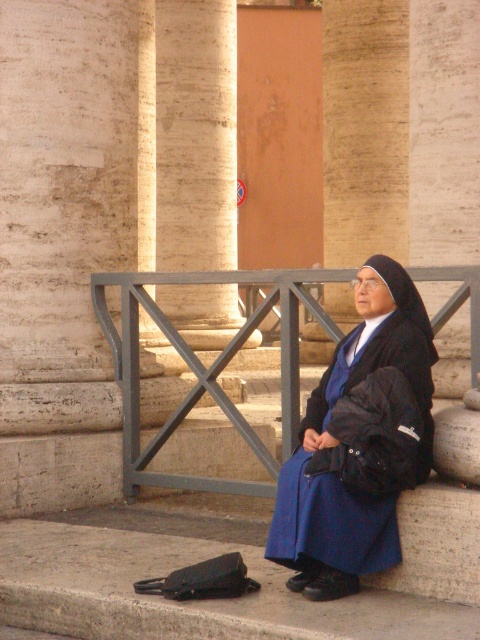
How much distance is there between metallic gray rail at center and blue fabric nun at center?

6.98 meters

Is metallic gray rail at center to the left of blue fabric nun at center from the viewer's perspective?

Yes, metallic gray rail at center is to the left of blue fabric nun at center.

The image size is (480, 640). Identify the location of metallic gray rail at center. (208, 365).

Where is `metallic gray rail at center`? metallic gray rail at center is located at coordinates click(x=208, y=365).

Between smooth stone pillar at center and blue fabric nun at center, which one has more height?

With more height is smooth stone pillar at center.

Between point (381, 188) and point (335, 483), which one is positioned in front?

Positioned in front is point (335, 483).

Who is more distant from viewer, (352, 49) or (337, 372)?

The point (352, 49) is behind.

Where is `smooth stone pillar at center`? smooth stone pillar at center is located at coordinates (364, 129).

Looking at this image, between white marble pillar at center and blue fabric nun at center, which one appears on the left side from the viewer's perspective?

white marble pillar at center is more to the left.

Is white marble pillar at center behind blue fabric nun at center?

Yes.

The height and width of the screenshot is (640, 480). I want to click on white marble pillar at center, so click(195, 134).

Locate an element on the screen. The image size is (480, 640). white marble pillar at center is located at coordinates click(195, 134).